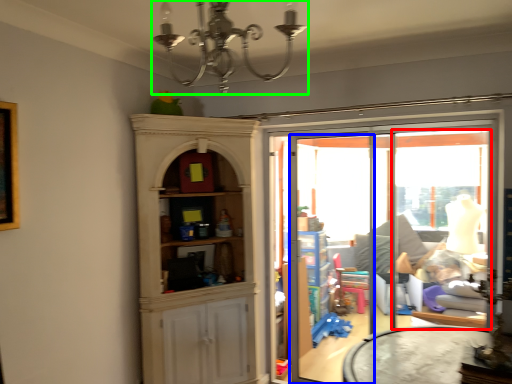
Question: Considering the real-world distances, which object is closest to window (highlighted by a red box)? screen door (highlighted by a blue box) or light fixture (highlighted by a green box).

Choices:
 (A) screen door
 (B) light fixture

Answer: (A)